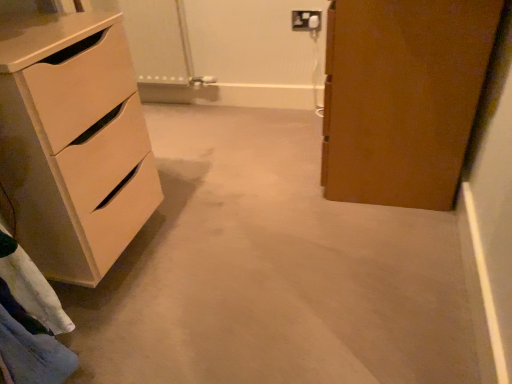
Identify the location of white plastic electric outlet at upper center. (306, 20).

What is the approximate height of white plastic electric outlet at upper center?

It is 4.54 inches.

You are a GUI agent. You are given a task and a screenshot of the screen. Output one action in this format:
    pyautogui.click(x=<x>, y=<y>)
    Task: Click on the beige carpet at center
    Image resolution: width=512 pixels, height=384 pixels.
    Given the screenshot: What is the action you would take?
    pyautogui.click(x=271, y=271)

Can you tell me how much white plastic electric outlet at upper center and matte white chest of drawers at left differ in facing direction?

There is a 91.5-degree angle between the facing directions of white plastic electric outlet at upper center and matte white chest of drawers at left.

Where is `the chest of drawers located in front of the white plastic electric outlet at upper center`? the chest of drawers located in front of the white plastic electric outlet at upper center is located at coordinates (73, 142).

Could you tell me if white plastic electric outlet at upper center is turned towards matte white chest of drawers at left?

Yes, white plastic electric outlet at upper center faces towards matte white chest of drawers at left.

Is beige carpet at center a part of matte white chest of drawers at left?

No.

Could you tell me if matte white chest of drawers at left is facing beige carpet at center?

No, matte white chest of drawers at left does not turn towards beige carpet at center.

Considering the positions of points (129, 147) and (233, 310), is point (129, 147) farther from camera compared to point (233, 310)?

Yes.

Considering the relative positions of matte white chest of drawers at left and beige carpet at center in the image provided, is matte white chest of drawers at left to the left or to the right of beige carpet at center?

Based on their positions, matte white chest of drawers at left is located to the left of beige carpet at center.

Between white plastic electric outlet at upper center and beige carpet at center, which one has smaller size?

white plastic electric outlet at upper center.

Is white plastic electric outlet at upper center in front of or behind beige carpet at center in the image?

white plastic electric outlet at upper center is positioned farther from the viewer than beige carpet at center.

Are white plastic electric outlet at upper center and beige carpet at center far apart?

Yes, white plastic electric outlet at upper center and beige carpet at center are located far from each other.

From a real-world perspective, who is located higher, white plastic electric outlet at upper center or beige carpet at center?

white plastic electric outlet at upper center, from a real-world perspective.

Is beige carpet at center looking in the opposite direction of white plastic electric outlet at upper center?

That's not correct — beige carpet at center is not looking away from white plastic electric outlet at upper center.

Is beige carpet at center with white plastic electric outlet at upper center?

No, beige carpet at center is not beside white plastic electric outlet at upper center.

Considering the sizes of beige carpet at center and white plastic electric outlet at upper center in the image, is beige carpet at center bigger or smaller than white plastic electric outlet at upper center?

Considering their sizes, beige carpet at center takes up more space than white plastic electric outlet at upper center.

Which of these two, beige carpet at center or white plastic electric outlet at upper center, stands shorter?

beige carpet at center is shorter.

Are beige carpet at center and matte white chest of drawers at left far apart?

That's not correct — beige carpet at center is a little close to matte white chest of drawers at left.

Does beige carpet at center have a lesser height compared to matte white chest of drawers at left?

Yes.

Which of these two, beige carpet at center or matte white chest of drawers at left, is thinner?

Thinner between the two is matte white chest of drawers at left.

Which is more to the right, beige carpet at center or matte white chest of drawers at left?

From the viewer's perspective, beige carpet at center appears more on the right side.

From the picture: Which object is positioned more to the right, matte white chest of drawers at left or white plastic electric outlet at upper center?

white plastic electric outlet at upper center.

Is matte white chest of drawers at left facing towards white plastic electric outlet at upper center?

No, matte white chest of drawers at left is not facing towards white plastic electric outlet at upper center.

From the image's perspective, is matte white chest of drawers at left over white plastic electric outlet at upper center?

Incorrect, from the image's perspective, matte white chest of drawers at left is lower than white plastic electric outlet at upper center.

Measure the distance between matte white chest of drawers at left and white plastic electric outlet at upper center.

matte white chest of drawers at left and white plastic electric outlet at upper center are 1.41 meters apart.

Locate an element on the screen. Image resolution: width=512 pixels, height=384 pixels. electric outlet above the matte white chest of drawers at left (from a real-world perspective) is located at coordinates (306, 20).

This screenshot has height=384, width=512. In order to click on concrete in front of the matte white chest of drawers at left in this screenshot , I will do `click(271, 271)`.

Considering their positions, is beige carpet at center positioned closer to matte white chest of drawers at left than white plastic electric outlet at upper center?

beige carpet at center is positioned closer to the anchor matte white chest of drawers at left.

From the image, which object appears to be farther from white plastic electric outlet at upper center, beige carpet at center or matte white chest of drawers at left?

matte white chest of drawers at left lies further to white plastic electric outlet at upper center than the other object.

When comparing their distances from beige carpet at center, does white plastic electric outlet at upper center or matte white chest of drawers at left seem closer?

matte white chest of drawers at left.

Based on their spatial positions, is matte white chest of drawers at left or white plastic electric outlet at upper center further from beige carpet at center?

The object further to beige carpet at center is white plastic electric outlet at upper center.

Based on the photo, considering their positions, is white plastic electric outlet at upper center positioned further to matte white chest of drawers at left than beige carpet at center?

white plastic electric outlet at upper center lies further to matte white chest of drawers at left than the other object.

Based on their spatial positions, is matte white chest of drawers at left or beige carpet at center further from white plastic electric outlet at upper center?

The object further to white plastic electric outlet at upper center is matte white chest of drawers at left.

Image resolution: width=512 pixels, height=384 pixels. I want to click on chest of drawers between beige carpet at center and white plastic electric outlet at upper center along the z-axis, so click(x=73, y=142).